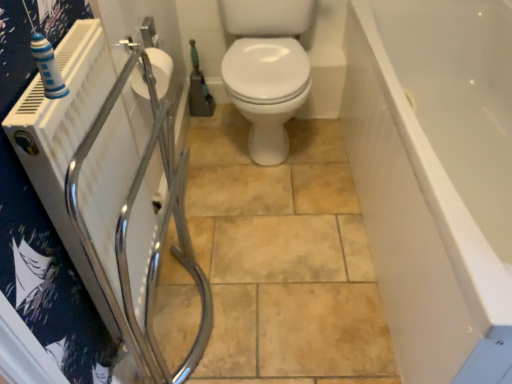
Where is `white matte toilet paper at upper left`? white matte toilet paper at upper left is located at coordinates (160, 69).

You are a GUI agent. You are given a task and a screenshot of the screen. Output one action in this format:
    pyautogui.click(x=<x>, y=<y>)
    Task: Click on the white glossy bathtub at right
    This screenshot has height=384, width=512.
    Given the screenshot: What is the action you would take?
    pyautogui.click(x=436, y=178)

The height and width of the screenshot is (384, 512). What do you see at coordinates (436, 178) in the screenshot?
I see `white glossy bathtub at right` at bounding box center [436, 178].

Where is `white matte toilet paper at upper left`? white matte toilet paper at upper left is located at coordinates (160, 69).

Is white glossy bathtub at right positioned with its back to green rubber garden hose at center?

white glossy bathtub at right is not turned away from green rubber garden hose at center.

Where is `bath located below the green rubber garden hose at center (from the image's perspective)`? The width and height of the screenshot is (512, 384). bath located below the green rubber garden hose at center (from the image's perspective) is located at coordinates (436, 178).

Is white glossy bathtub at right positioned in front of green rubber garden hose at center?

Yes, it is.

Can green rubber garden hose at center be found inside white glossy bathtub at right?

No, green rubber garden hose at center is not surrounded by white glossy bathtub at right.

From the image's perspective, is green rubber garden hose at center located beneath white glossy bathtub at right?

No, from the image's perspective, green rubber garden hose at center is not below white glossy bathtub at right.

Would you consider green rubber garden hose at center to be distant from white glossy bathtub at right?

Yes, green rubber garden hose at center and white glossy bathtub at right are quite far apart.

Considering the sizes of green rubber garden hose at center and white glossy bathtub at right in the image, is green rubber garden hose at center taller or shorter than white glossy bathtub at right?

Considering their sizes, green rubber garden hose at center has less height than white glossy bathtub at right.

Is green rubber garden hose at center further to the viewer compared to white glossy bathtub at right?

Yes, green rubber garden hose at center is further from the camera.

Is white matte toilet paper at upper left touching white glossy bathtub at right?

white matte toilet paper at upper left is not next to white glossy bathtub at right, and they're not touching.

Considering the positions of objects white matte toilet paper at upper left and white glossy bathtub at right in the image provided, who is more to the right, white matte toilet paper at upper left or white glossy bathtub at right?

white glossy bathtub at right is more to the right.

Find the location of a particular element. toilet paper positioned vertically above the white glossy bathtub at right (from a real-world perspective) is located at coordinates (160, 69).

From a real-world perspective, who is located lower, white matte toilet paper at upper left or white glossy bathtub at right?

In real-world perspective, white glossy bathtub at right is lower.

From a real-world perspective, between white matte toilet paper at upper left and green rubber garden hose at center, who is vertically lower?

green rubber garden hose at center, from a real-world perspective.

Which object is closer to the camera taking this photo, white matte toilet paper at upper left or green rubber garden hose at center?

white matte toilet paper at upper left is in front.

The height and width of the screenshot is (384, 512). Identify the location of toilet paper below the green rubber garden hose at center (from the image's perspective). (160, 69).

Is green rubber garden hose at center at the back of white matte toilet paper at upper left?

No.

Is white glossy bathtub at right taller or shorter than white matte toilet paper at upper left?

white glossy bathtub at right is taller than white matte toilet paper at upper left.

From a real-world perspective, who is located lower, white glossy bathtub at right or white matte toilet paper at upper left?

In real-world perspective, white glossy bathtub at right is lower.

The image size is (512, 384). I want to click on toilet paper lying above the white glossy bathtub at right (from the image's perspective), so click(160, 69).

Between white glossy bathtub at right and white matte toilet paper at upper left, which one has larger width?

white glossy bathtub at right is wider.

From a real-world perspective, is green rubber garden hose at center above or below white matte toilet paper at upper left?

Clearly, from a real-world perspective, green rubber garden hose at center is below white matte toilet paper at upper left.

Based on the photo, is green rubber garden hose at center to the left of white matte toilet paper at upper left from the viewer's perspective?

In fact, green rubber garden hose at center is to the right of white matte toilet paper at upper left.

Where is `toilet paper that is on the left side of green rubber garden hose at center`? toilet paper that is on the left side of green rubber garden hose at center is located at coordinates (160, 69).

The image size is (512, 384). Find the location of `bath to the right of green rubber garden hose at center`. bath to the right of green rubber garden hose at center is located at coordinates (436, 178).

I want to click on garden hose above the white glossy bathtub at right (from the image's perspective), so click(x=199, y=88).

Based on their spatial positions, is white glossy bathtub at right or white matte toilet paper at upper left closer to green rubber garden hose at center?

Based on the image, white matte toilet paper at upper left appears to be nearer to green rubber garden hose at center.

Estimate the real-world distances between objects in this image. Which object is closer to white glossy bathtub at right, white matte toilet paper at upper left or green rubber garden hose at center?

Among the two, white matte toilet paper at upper left is located nearer to white glossy bathtub at right.

Considering their positions, is green rubber garden hose at center positioned closer to white glossy bathtub at right than white matte toilet paper at upper left?

white matte toilet paper at upper left is closer to white glossy bathtub at right.

Estimate the real-world distances between objects in this image. Which object is closer to green rubber garden hose at center, white matte toilet paper at upper left or white glossy bathtub at right?

white matte toilet paper at upper left lies closer to green rubber garden hose at center than the other object.

Estimate the real-world distances between objects in this image. Which object is closer to white matte toilet paper at upper left, green rubber garden hose at center or white glossy bathtub at right?

Based on the image, green rubber garden hose at center appears to be nearer to white matte toilet paper at upper left.

Looking at this image, from the image, which object appears to be nearer to white matte toilet paper at upper left, white glossy bathtub at right or green rubber garden hose at center?

green rubber garden hose at center.

Image resolution: width=512 pixels, height=384 pixels. Find the location of `garden hose between white matte toilet paper at upper left and white glossy bathtub at right`. garden hose between white matte toilet paper at upper left and white glossy bathtub at right is located at coordinates (199, 88).